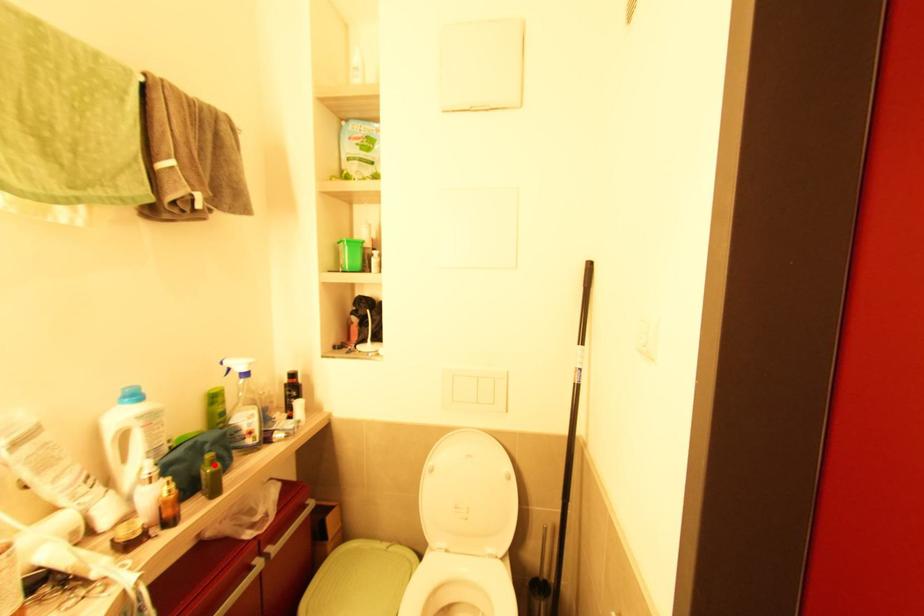
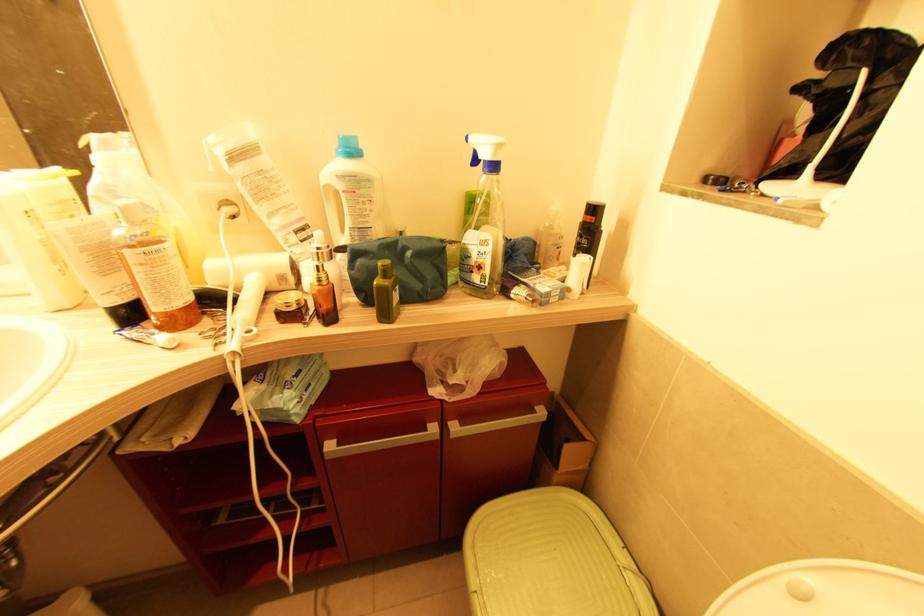
The point at the highlighted location is marked in the first image. Where is the corresponding point in the second image?

(386, 278)